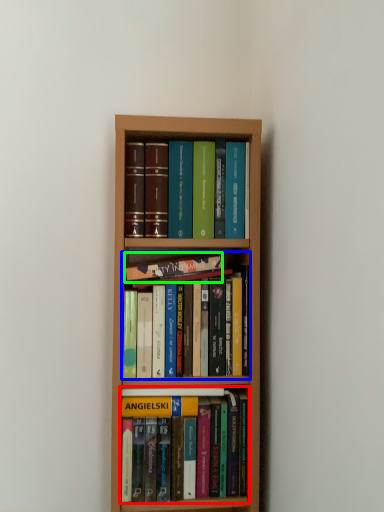
Question: Based on their relative distances, which object is nearer to book (highlighted by a red box)? Choose from book (highlighted by a blue box) and book (highlighted by a green box).

Choices:
 (A) book
 (B) book

Answer: (A)